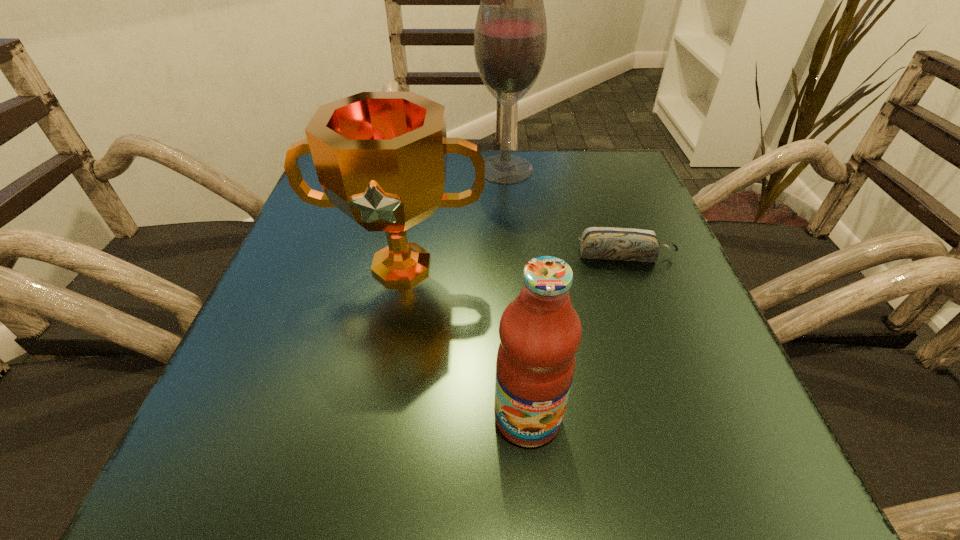
Point out which object is positioned as the third nearest to the fruit juice. Please provide its 2D coordinates. Your answer should be formatted as a tuple, i.e. [(x, y)], where the tuple contains the x and y coordinates of a point satisfying the conditions above.

[(510, 38)]